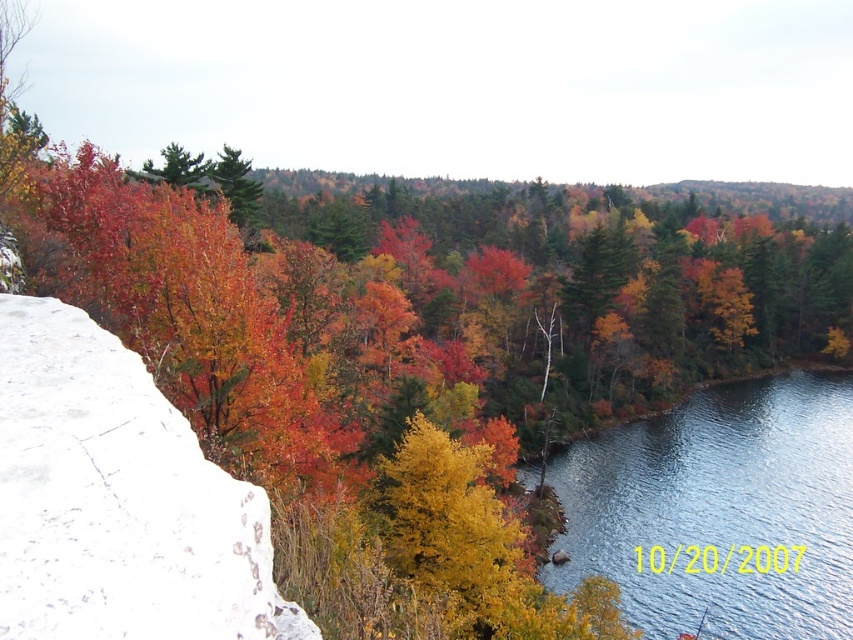
Question: Is white rough stone at left below blue smooth water at lower right?

Choices:
 (A) yes
 (B) no

Answer: (B)

Question: Is white rough stone at left smaller than blue smooth water at lower right?

Choices:
 (A) no
 (B) yes

Answer: (B)

Question: Among these objects, which one is farthest from the camera?

Choices:
 (A) white rough stone at left
 (B) blue smooth water at lower right

Answer: (B)

Question: Which point is farther to the camera?

Choices:
 (A) (15, 420)
 (B) (758, 472)

Answer: (B)

Question: Which object is closer to the camera taking this photo?

Choices:
 (A) blue smooth water at lower right
 (B) white rough stone at left

Answer: (B)

Question: From the image, what is the correct spatial relationship of white rough stone at left in relation to blue smooth water at lower right?

Choices:
 (A) above
 (B) below

Answer: (A)